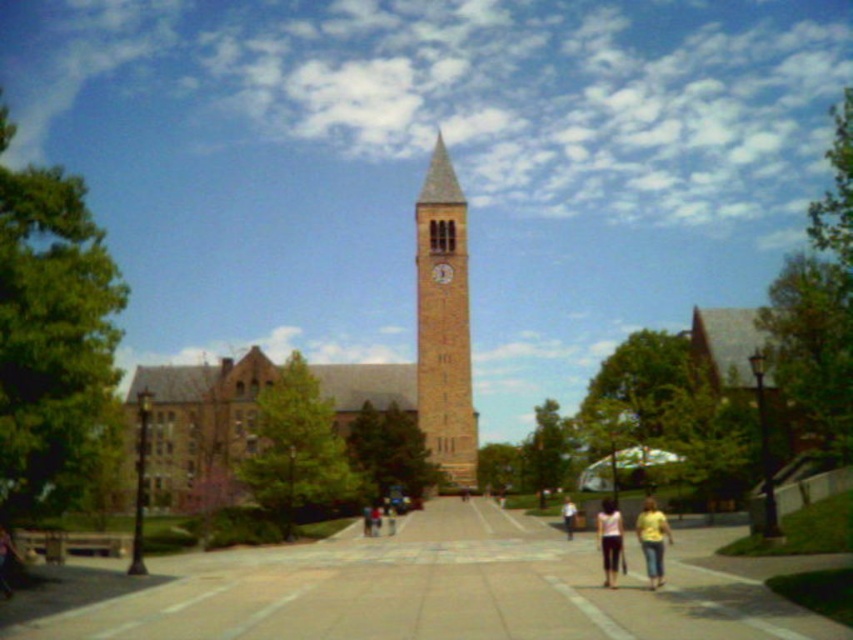
Question: Estimate the real-world distances between objects in this image. Which object is farther from the smooth concrete pavement at center?

Choices:
 (A) white cotton tank top at center
 (B) light blue jeans at center
 (C) brown stone church at center
 (D) wooden clock at center

Answer: (D)

Question: Can you confirm if yellow matte shirt at lower right is positioned above white cotton tank top at center?

Choices:
 (A) no
 (B) yes

Answer: (B)

Question: Can you confirm if yellow matte shirt at lower right is bigger than wooden clock at center?

Choices:
 (A) no
 (B) yes

Answer: (B)

Question: Which point is closer to the camera taking this photo?

Choices:
 (A) (572, 516)
 (B) (605, 515)
 (C) (648, 499)

Answer: (B)

Question: Can you confirm if smooth concrete pavement at center is bigger than light pink cotton shirt at center?

Choices:
 (A) yes
 (B) no

Answer: (A)

Question: Which of the following is the closest to the observer?

Choices:
 (A) light blue jeans at center
 (B) brown brick clock tower at center
 (C) wooden clock at center

Answer: (A)